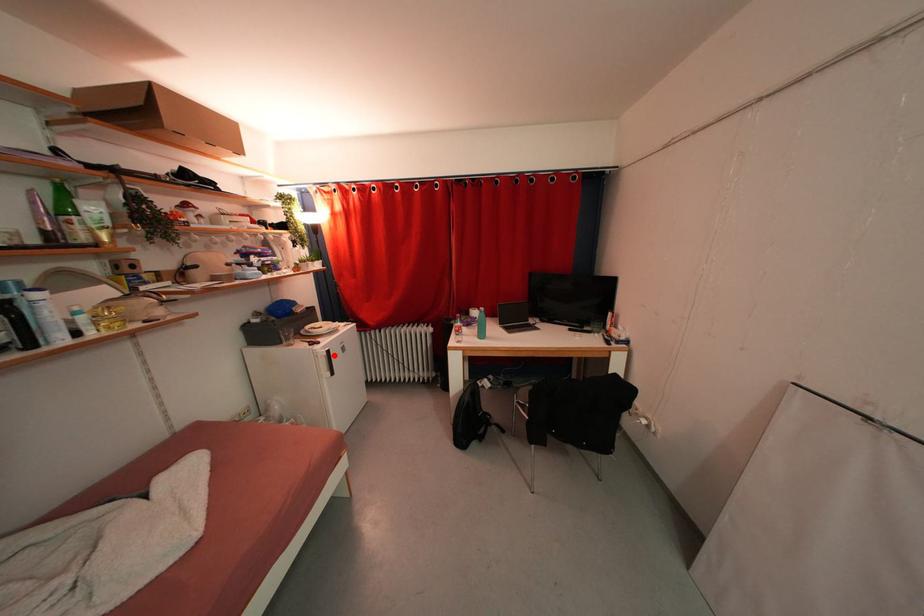
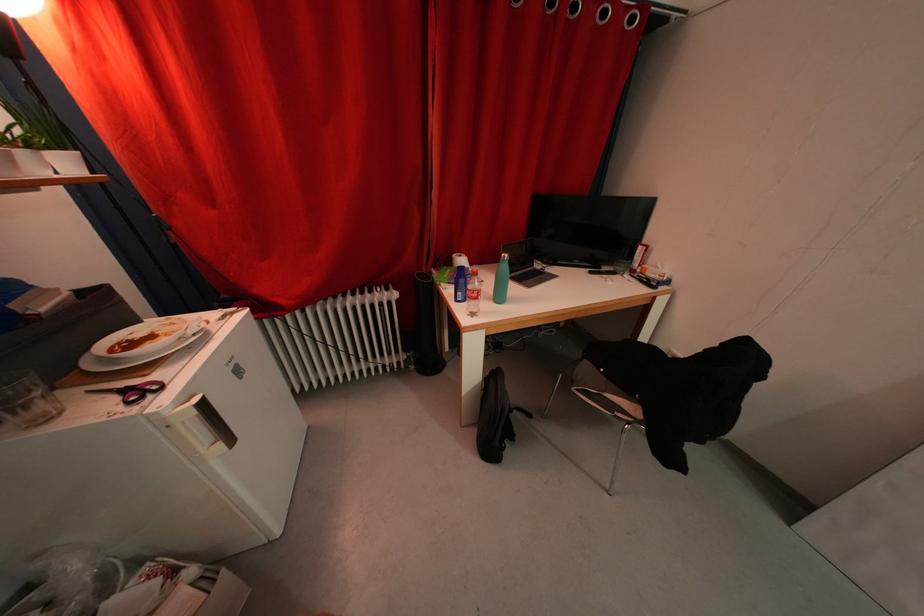
In the second image, find the point that corresponds to the highlighted location in the first image.

(209, 408)